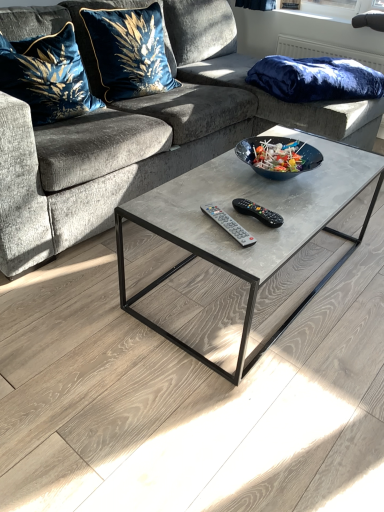
Question: Does velvet blue pillow at upper left, marked as the first pillow in a left-to-right arrangement, have a greater height compared to velvety blue pillow at upper right, arranged as the 1th pillow when viewed from the right?

Choices:
 (A) yes
 (B) no

Answer: (A)

Question: Is velvety blue pillow at upper right, arranged as the 1th pillow when viewed from the right, inside velvet blue pillow at upper left, which appears as the third pillow when viewed from the right?

Choices:
 (A) yes
 (B) no

Answer: (B)

Question: From the image's perspective, is velvet blue pillow at upper left, which appears as the third pillow when viewed from the right, located beneath velvety blue pillow at upper right, arranged as the 1th pillow when viewed from the right?

Choices:
 (A) yes
 (B) no

Answer: (A)

Question: Considering the relative positions of velvet blue pillow at upper left, marked as the first pillow in a left-to-right arrangement, and velvety blue pillow at upper right, arranged as the 1th pillow when viewed from the right, in the image provided, is velvet blue pillow at upper left, marked as the first pillow in a left-to-right arrangement, behind velvety blue pillow at upper right, arranged as the 1th pillow when viewed from the right,?

Choices:
 (A) no
 (B) yes

Answer: (A)

Question: From a real-world perspective, is velvet blue pillow at upper left, marked as the first pillow in a left-to-right arrangement, physically above velvety blue pillow at upper right, arranged as the 1th pillow when viewed from the right?

Choices:
 (A) yes
 (B) no

Answer: (A)

Question: Which is correct: velvet blue pillow at upper left, which appears as the third pillow when viewed from the right, is inside velvety blue pillow at upper right, arranged as the 1th pillow when viewed from the right, or outside of it?

Choices:
 (A) outside
 (B) inside

Answer: (A)

Question: In the image, is velvet blue pillow at upper left, marked as the first pillow in a left-to-right arrangement, positioned in front of or behind velvety blue pillow at upper right, arranged as the 1th pillow when viewed from the right?

Choices:
 (A) front
 (B) behind

Answer: (A)

Question: From the image's perspective, is velvet blue pillow at upper left, marked as the first pillow in a left-to-right arrangement, above or below velvety blue pillow at upper right, arranged as the 1th pillow when viewed from the right?

Choices:
 (A) below
 (B) above

Answer: (A)

Question: Looking at their shapes, would you say velvet blue pillow at upper left, marked as the first pillow in a left-to-right arrangement, is wider or thinner than velvety blue pillow at upper right, which is counted as the third pillow, starting from the left?

Choices:
 (A) thin
 (B) wide

Answer: (A)

Question: Is black plastic remote at center, marked as the 1th remote in a right-to-left arrangement, bigger or smaller than velvet blue pillow at upper left, marked as the first pillow in a left-to-right arrangement?

Choices:
 (A) small
 (B) big

Answer: (A)

Question: Is black plastic remote at center, marked as the 1th remote in a right-to-left arrangement, in front of or behind velvet blue pillow at upper left, which appears as the third pillow when viewed from the right, in the image?

Choices:
 (A) behind
 (B) front

Answer: (B)

Question: Looking at their shapes, would you say black plastic remote at center, the 2th remote in the left-to-right sequence, is wider or thinner than velvet blue pillow at upper left, which appears as the third pillow when viewed from the right?

Choices:
 (A) wide
 (B) thin

Answer: (B)

Question: Is point (266, 212) positioned closer to the camera than point (29, 37)?

Choices:
 (A) closer
 (B) farther

Answer: (A)

Question: Is velvet fabric couch at center in front of or behind velvet blue pillow at upper left, which appears as the second pillow when viewed from the right, in the image?

Choices:
 (A) behind
 (B) front

Answer: (B)

Question: Considering the positions of velvet fabric couch at center and velvet blue pillow at upper left, which appears as the second pillow when viewed from the left, in the image, is velvet fabric couch at center wider or thinner than velvet blue pillow at upper left, which appears as the second pillow when viewed from the left,?

Choices:
 (A) wide
 (B) thin

Answer: (A)